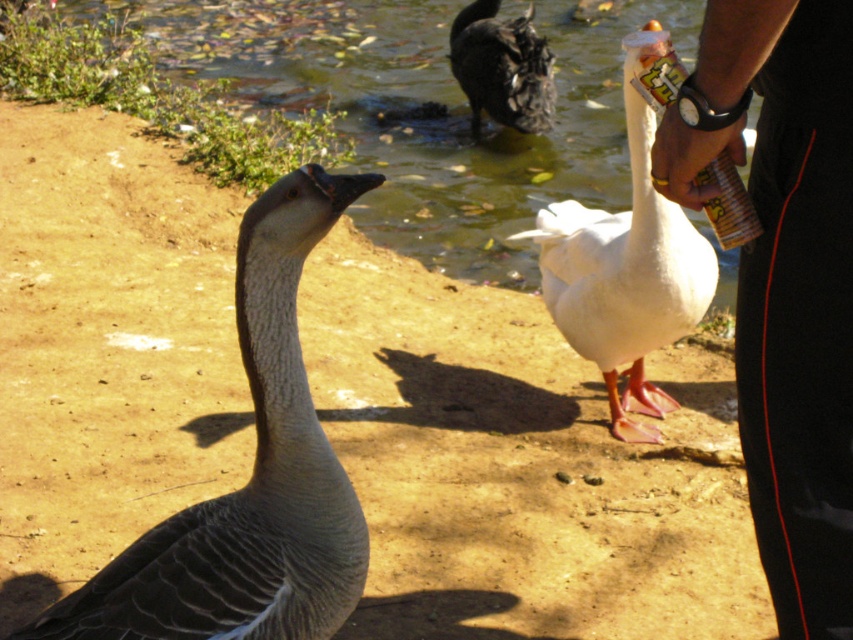
Which is below, greenish water at center or dark gray duck at upper center?

dark gray duck at upper center

The image size is (853, 640). In order to click on greenish water at center in this screenshot , I will do `click(421, 106)`.

The image size is (853, 640). I want to click on greenish water at center, so click(x=421, y=106).

Which is behind, point (834, 138) or point (178, 568)?

The point (178, 568) is behind.

This screenshot has height=640, width=853. Describe the element at coordinates (785, 282) in the screenshot. I see `black fabric pants at right` at that location.

Locate an element on the screen. black fabric pants at right is located at coordinates (785, 282).

Between gray feathered goose at center and dark gray duck at upper center, which one appears on the left side from the viewer's perspective?

From the viewer's perspective, gray feathered goose at center appears more on the left side.

Can you confirm if gray feathered goose at center is positioned to the right of dark gray duck at upper center?

No, gray feathered goose at center is not to the right of dark gray duck at upper center.

Is point (190, 604) positioned before point (521, 48)?

Yes, it is in front of point (521, 48).

At what (x,y) coordinates should I click in order to perform the action: click on gray feathered goose at center. Please return your answer as a coordinate pair (x, y). Looking at the image, I should click on (250, 476).